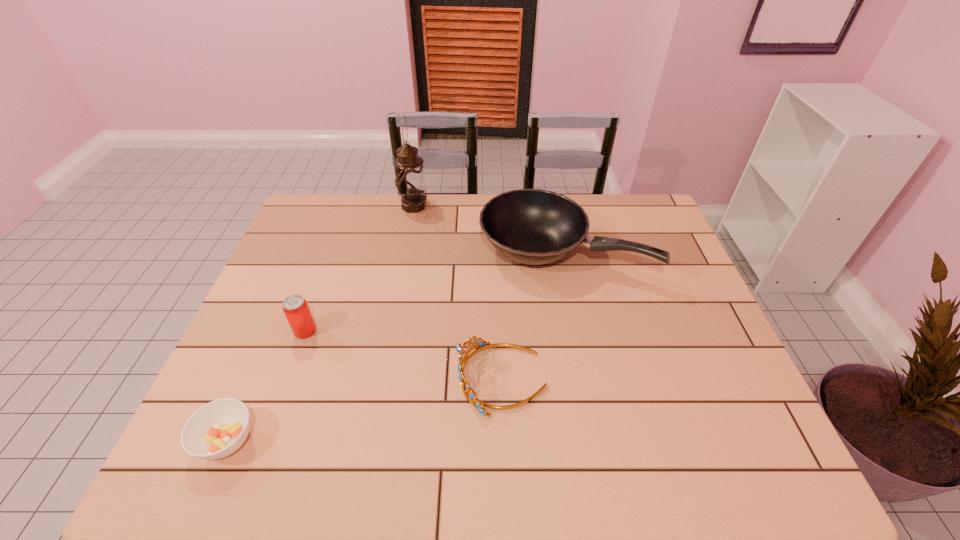
Locate an element on the screen. free spot between the third nearest object and the frying pan is located at coordinates (434, 291).

The image size is (960, 540). I want to click on empty space between the tiara and the can, so click(x=403, y=355).

Image resolution: width=960 pixels, height=540 pixels. In order to click on vacant space that's between the oil lamp and the soup bowl in this screenshot , I will do `click(321, 323)`.

You are a GUI agent. You are given a task and a screenshot of the screen. Output one action in this format:
    pyautogui.click(x=<x>, y=<y>)
    Task: Click on the free area in between the can and the frying pan
    
    Given the screenshot: What is the action you would take?
    pyautogui.click(x=434, y=291)

Image resolution: width=960 pixels, height=540 pixels. I want to click on free spot between the shortest object and the third nearest object, so click(x=266, y=386).

At what (x,y) coordinates should I click in order to perform the action: click on vacant space that's between the frying pan and the soup bowl. Please return your answer as a coordinate pair (x, y). Looking at the image, I should click on [x=395, y=346].

Identify which object is the third closest to the tiara. Please provide its 2D coordinates. Your answer should be formatted as a tuple, i.e. [(x, y)], where the tuple contains the x and y coordinates of a point satisfying the conditions above.

[(216, 430)]

Where is `object that stands as the second closest to the can`? This screenshot has width=960, height=540. object that stands as the second closest to the can is located at coordinates (463, 355).

Locate an element on the screen. Image resolution: width=960 pixels, height=540 pixels. free location that satisfies the following two spatial constraints: 1. on the back side of the can; 2. on the right side of the second farthest object is located at coordinates (334, 251).